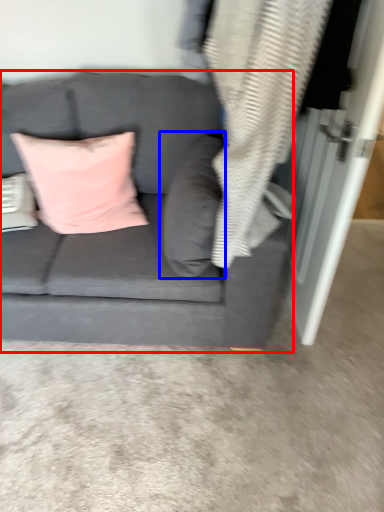
Question: Which of the following is the farthest to the observer, studio couch (highlighted by a red box) or pillow (highlighted by a blue box)?

Choices:
 (A) studio couch
 (B) pillow

Answer: (B)